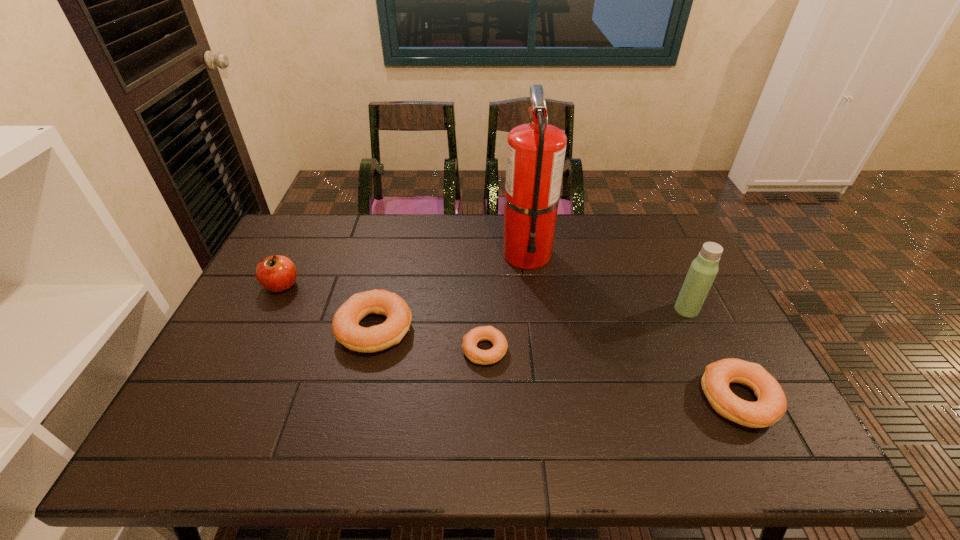
Identify the location of the leftmost bagel. (345, 326).

Where is `the shortest bagel`? This screenshot has width=960, height=540. the shortest bagel is located at coordinates (482, 333).

Where is `the shortest object`? This screenshot has height=540, width=960. the shortest object is located at coordinates (482, 333).

Image resolution: width=960 pixels, height=540 pixels. I want to click on the second shortest bagel, so click(771, 405).

Image resolution: width=960 pixels, height=540 pixels. I want to click on the second shortest object, so click(771, 405).

Locate an element on the screen. the tallest object is located at coordinates (535, 151).

Where is `fire extinguisher`? The width and height of the screenshot is (960, 540). fire extinguisher is located at coordinates (535, 151).

Identify the location of thermos bottle. This screenshot has height=540, width=960. (704, 268).

Identify the location of the fourth shortest object. (277, 273).

Locate an element on the screen. Image resolution: width=960 pixels, height=540 pixels. apple is located at coordinates (277, 273).